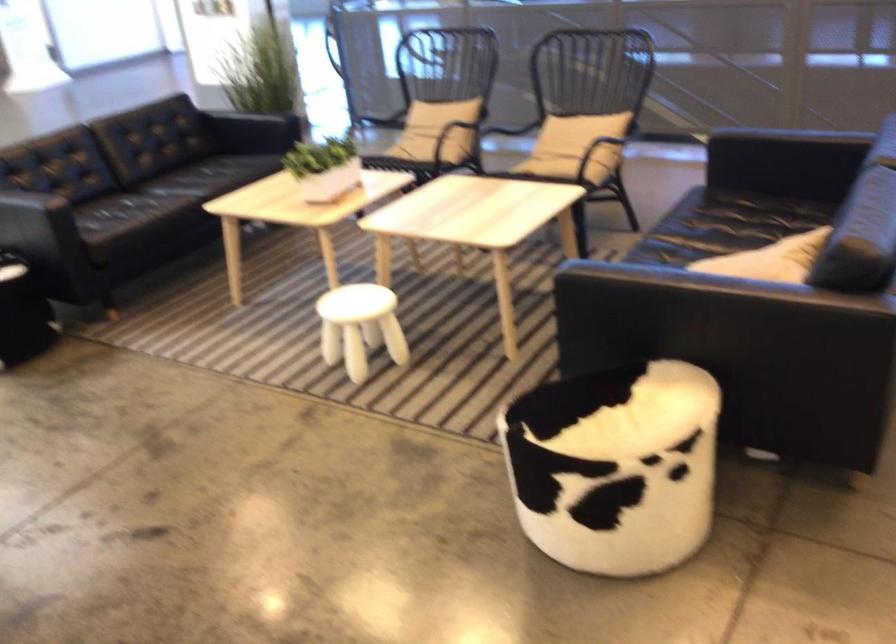
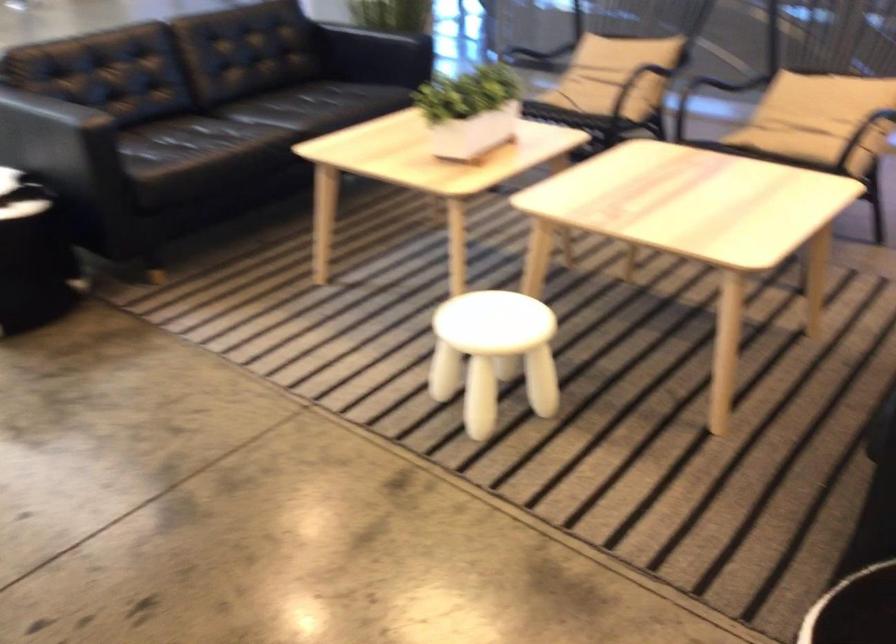
Question: I am providing you with two images of the same scene from different viewpoints. Which of the following objects are not visible in image2?

Choices:
 (A) white stool
 (B) blue handled scissors
 (C) sofa armrest
 (D) chair sitting surface

Answer: (D)